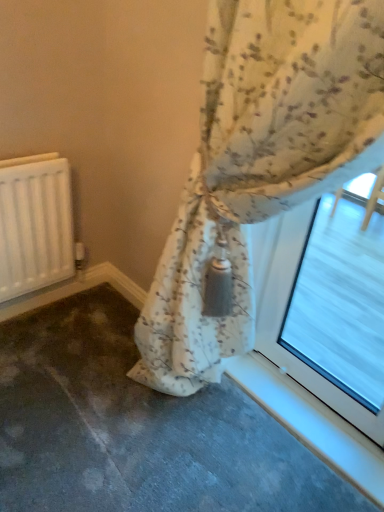
Question: From a real-world perspective, relative to floral fabric curtain at center, is transparent glass at upper right vertically above or below?

Choices:
 (A) below
 (B) above

Answer: (A)

Question: Does point (375, 395) appear closer or farther from the camera than point (382, 95)?

Choices:
 (A) farther
 (B) closer

Answer: (A)

Question: Based on their relative distances, which object is nearer to the transparent glass at upper right?

Choices:
 (A) white matte radiator at left
 (B) floral fabric curtain at center

Answer: (B)

Question: Estimate the real-world distances between objects in this image. Which object is closer to the transparent glass at upper right?

Choices:
 (A) floral fabric curtain at center
 (B) white matte radiator at left

Answer: (A)